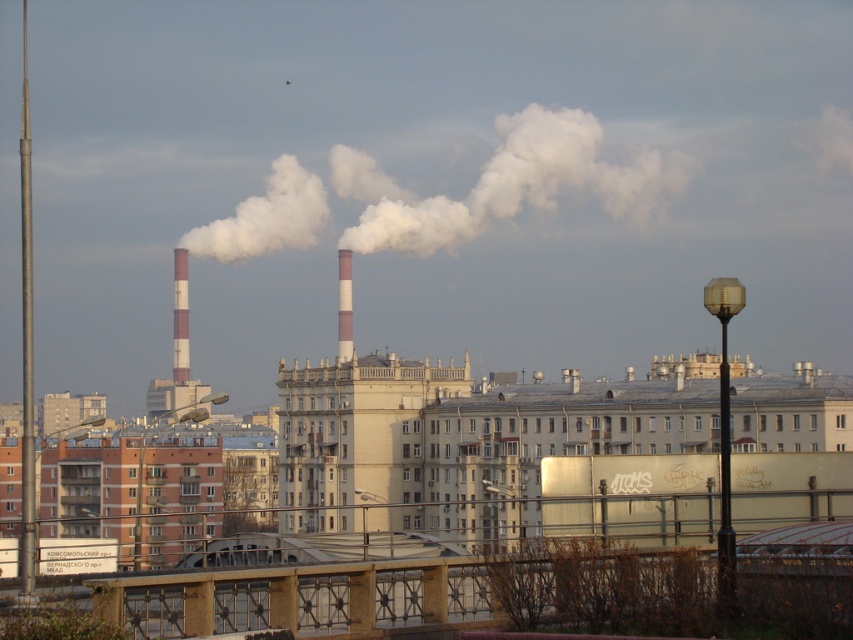
Question: Can you confirm if white smoke at center is positioned below red brick chimney at center?

Choices:
 (A) yes
 (B) no

Answer: (B)

Question: Is white smoke at center closer to the viewer compared to white striped chimney at center?

Choices:
 (A) no
 (B) yes

Answer: (A)

Question: Estimate the real-world distances between objects in this image. Which object is closer to the white striped chimney at center?

Choices:
 (A) white smoke at center
 (B) red brick chimney at center

Answer: (B)

Question: Which point is farther to the camera?

Choices:
 (A) (396, 211)
 (B) (351, 324)
 (C) (189, 360)

Answer: (A)

Question: Can you confirm if white smoke at center is smaller than white striped chimney at center?

Choices:
 (A) yes
 (B) no

Answer: (B)

Question: Which object is positioned farthest from the white striped chimney at center?

Choices:
 (A) red brick chimney at center
 (B) white smoke at center

Answer: (B)